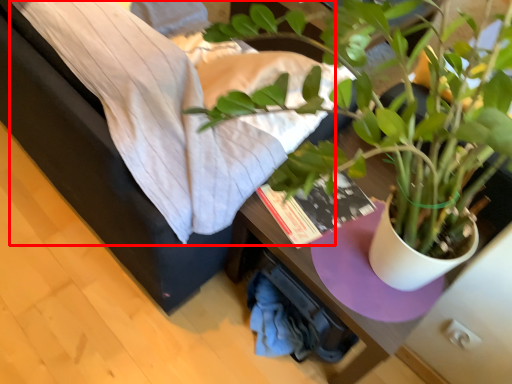
Question: Considering the relative positions of sheet (annotated by the red box) and houseplant in the image provided, where is sheet (annotated by the red box) located with respect to the staircase?

Choices:
 (A) left
 (B) right

Answer: (A)